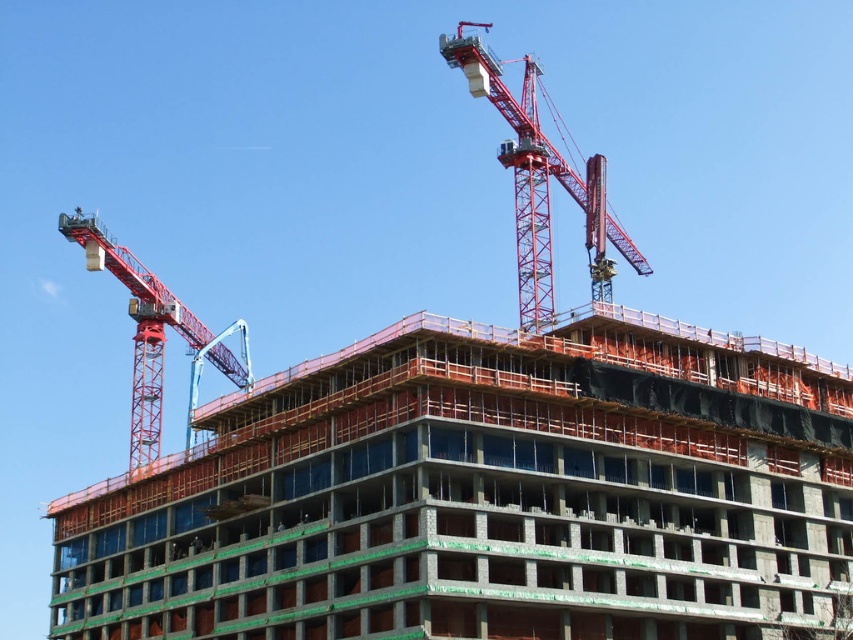
Question: Can you confirm if red metallic crane at upper center is positioned to the right of metal construction worker at upper left?

Choices:
 (A) no
 (B) yes

Answer: (B)

Question: Can you confirm if concrete at center is positioned below red metallic crane at upper center?

Choices:
 (A) no
 (B) yes

Answer: (B)

Question: Which of the following is the closest to the observer?

Choices:
 (A) (129, 275)
 (B) (630, 241)
 (C) (74, 214)

Answer: (A)

Question: Can you confirm if concrete at center is smaller than red metallic crane at upper center?

Choices:
 (A) yes
 (B) no

Answer: (A)

Question: Which point is closer to the camera?

Choices:
 (A) metallic red crane at upper left
 (B) metal construction worker at upper left

Answer: (A)

Question: Among these objects, which one is nearest to the camera?

Choices:
 (A) red metallic crane at upper center
 (B) metallic red crane at upper left
 (C) metal construction worker at upper left

Answer: (A)